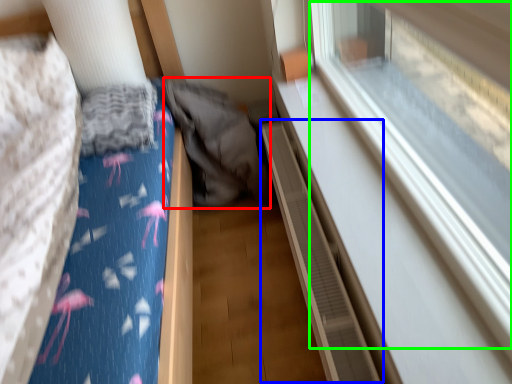
Question: Which object is the closest to the sleeping bag (highlighted by a red box)? Choose among these: balustrade (highlighted by a blue box) or train window (highlighted by a green box).

Choices:
 (A) balustrade
 (B) train window

Answer: (A)